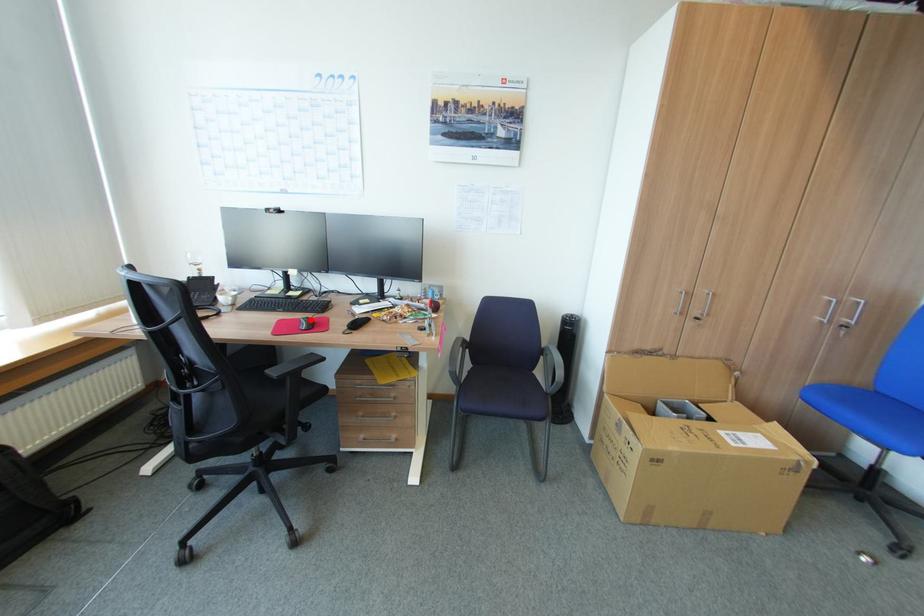
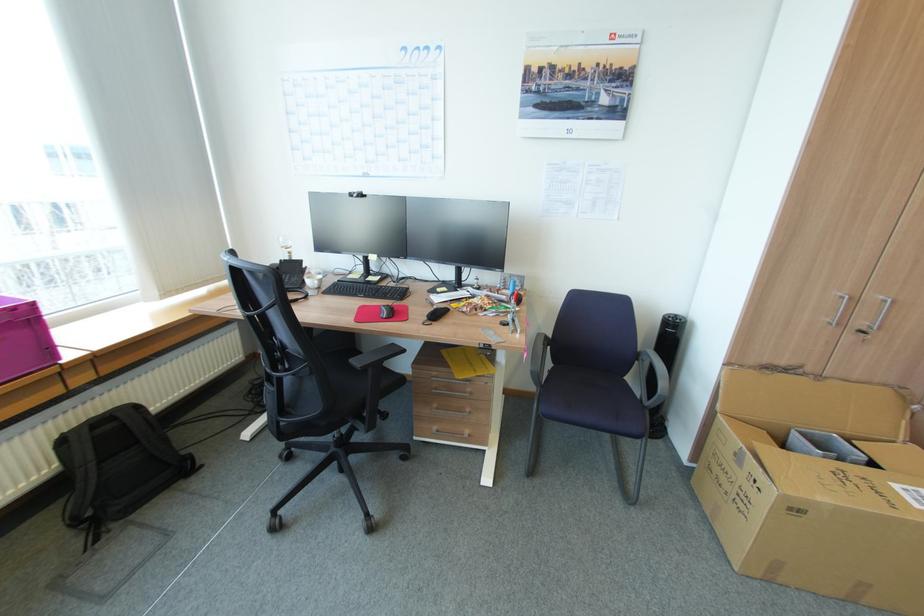
Where in the second image is the point corresponding to the highlighted location from the first image?

(391, 308)